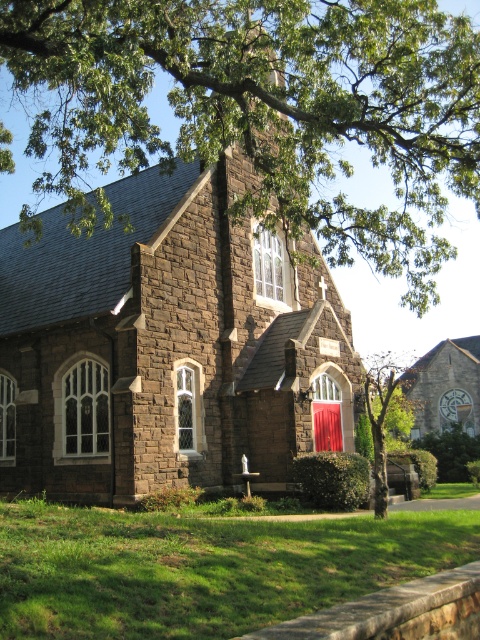
Which of these two, green leafy tree at upper center or green leafy tree at center, stands taller?

With more height is green leafy tree at upper center.

Who is more forward, (470, 193) or (367, 385)?

Point (470, 193)

Locate an element on the screen. Image resolution: width=480 pixels, height=640 pixels. green leafy tree at upper center is located at coordinates (263, 108).

Can you confirm if brown stone chapel at center is positioned below green leafy tree at upper center?

Yes, brown stone chapel at center is below green leafy tree at upper center.

Is brown stone chapel at center to the left of green leafy tree at upper center from the viewer's perspective?

Correct, you'll find brown stone chapel at center to the left of green leafy tree at upper center.

Describe the element at coordinates (168, 342) in the screenshot. I see `brown stone chapel at center` at that location.

What are the coordinates of `brown stone chapel at center` in the screenshot? It's located at (168, 342).

Does point (110, 356) come farther from viewer compared to point (385, 460)?

Yes, it is.

Where is `brown stone chapel at center`? The width and height of the screenshot is (480, 640). brown stone chapel at center is located at coordinates (168, 342).